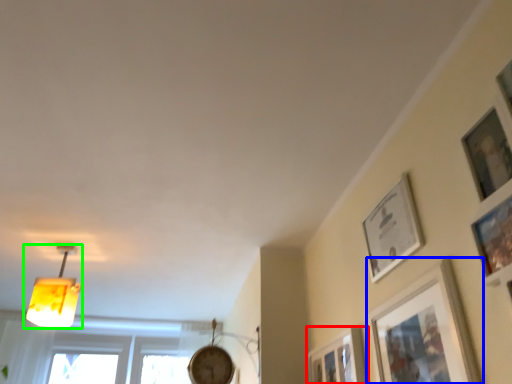
Question: Which is farther away from picture frame (highlighted by a red box)? picture frame (highlighted by a blue box) or lamp (highlighted by a green box)?

Choices:
 (A) picture frame
 (B) lamp

Answer: (B)